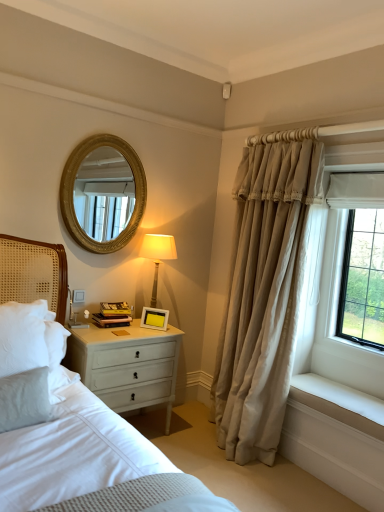
Locate an element on the screen. This screenshot has width=384, height=512. empty space that is ontop of white painted wood nightstand at lower left (from a real-world perspective) is located at coordinates (126, 325).